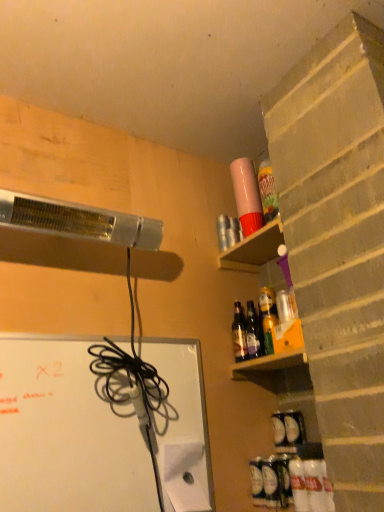
Question: Choose the correct answer: Is purple plastic cup at upper right inside translucent plastic bottle at lower right, placed as the 1th bottle when sorted from bottom to top, or outside it?

Choices:
 (A) outside
 (B) inside

Answer: (A)

Question: Is point (279, 228) positioned closer to the camera than point (299, 490)?

Choices:
 (A) farther
 (B) closer

Answer: (A)

Question: Estimate the real-world distances between objects in this image. Which object is farther from the translucent plastic bottle at lower right, which ranks as the first bottle in front-to-back order?

Choices:
 (A) shiny brown glass bottles at upper right, acting as the third bottle starting from the front
 (B) purple plastic cup at upper right
 (C) translucent glass bottles at shelf right, which is the 2th bottle from back to front
 (D) white matte bulletin board at lower left

Answer: (B)

Question: Which object is positioned farthest from the translucent glass bottles at shelf right, which is the 2th bottle from back to front?

Choices:
 (A) shiny brown glass bottles at upper right, placed as the 1th bottle when sorted from back to front
 (B) translucent plastic bottle at lower right, the 3th bottle in the back-to-front sequence
 (C) purple plastic cup at upper right
 (D) white matte bulletin board at lower left

Answer: (D)